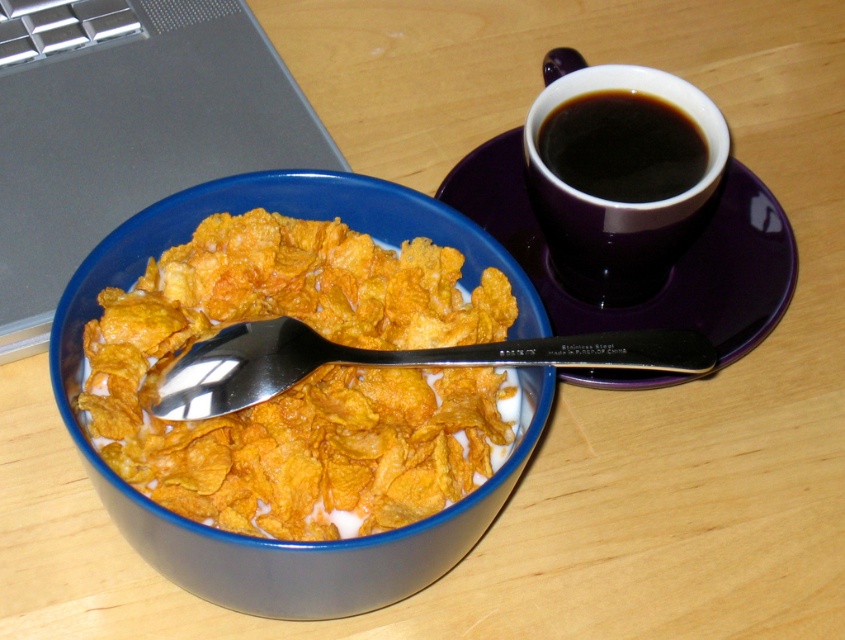
Consider the image. You are organizing a small workspace and need to place a keyboard between the silver metallic laptop at upper left and the black glossy cup at upper right. The keyboard requires at least 16 inches of space to fit. Based on the image, will there be enough space?

The distance between the silver metallic laptop at upper left and the black glossy cup at upper right is 15.98 inches, which is slightly less than the required 16 inches. Therefore, there is not enough space to place the keyboard between them.